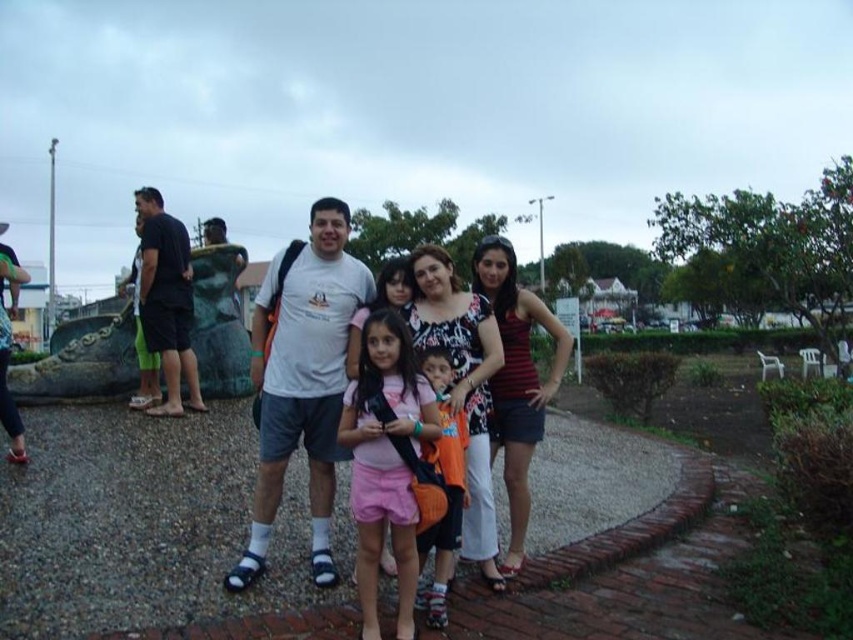
Question: Among these points, which one is farthest from the camera?

Choices:
 (A) coord(428,400)
 (B) coord(329,362)
 (C) coord(338,266)
 (D) coord(445,488)

Answer: (C)

Question: Can you confirm if white cotton shirt at center is positioned to the left of pink fabric shorts at center?

Choices:
 (A) no
 (B) yes

Answer: (A)

Question: Does white cotton shirt at center lie in front of white cotton t-shirt at center?

Choices:
 (A) no
 (B) yes

Answer: (A)

Question: Does white cotton shirt at center appear under pink fabric shorts at center?

Choices:
 (A) no
 (B) yes

Answer: (A)

Question: Which point is closer to the camera taking this photo?

Choices:
 (A) (491, 365)
 (B) (424, 605)
 (C) (410, 568)
 (D) (276, 298)

Answer: (C)

Question: Which object is farther from the camera taking this photo?

Choices:
 (A) white cotton shirt at center
 (B) orange fabric shirt at center
 (C) pink fabric shorts at center

Answer: (A)